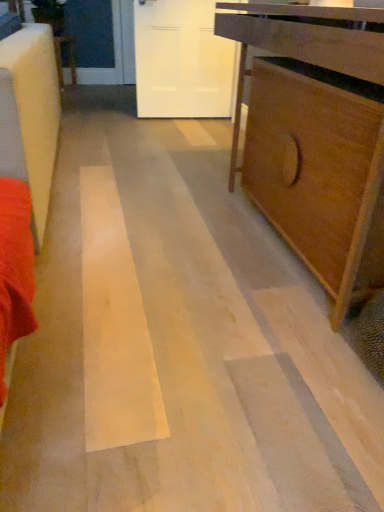
Question: Considering the relative sizes of matte brown cabinet at right and wooden table at center in the image provided, is matte brown cabinet at right wider than wooden table at center?

Choices:
 (A) no
 (B) yes

Answer: (B)

Question: Could you tell me if matte brown cabinet at right is turned towards wooden table at center?

Choices:
 (A) no
 (B) yes

Answer: (A)

Question: From the image's perspective, is matte brown cabinet at right under wooden table at center?

Choices:
 (A) yes
 (B) no

Answer: (A)

Question: Is matte brown cabinet at right turned away from wooden table at center?

Choices:
 (A) no
 (B) yes

Answer: (A)

Question: Does matte brown cabinet at right have a greater height compared to wooden table at center?

Choices:
 (A) no
 (B) yes

Answer: (B)

Question: Visually, is matte brown cabinet at right positioned to the left or to the right of white matte door at upper center?

Choices:
 (A) left
 (B) right

Answer: (B)

Question: From the image's perspective, is matte brown cabinet at right located above or below white matte door at upper center?

Choices:
 (A) below
 (B) above

Answer: (A)

Question: From a real-world perspective, is matte brown cabinet at right above or below white matte door at upper center?

Choices:
 (A) below
 (B) above

Answer: (A)

Question: Is matte brown cabinet at right situated inside white matte door at upper center or outside?

Choices:
 (A) inside
 (B) outside

Answer: (B)

Question: Is point (152, 106) positioned closer to the camera than point (352, 11)?

Choices:
 (A) closer
 (B) farther

Answer: (B)

Question: From a real-world perspective, is white matte door at upper center above or below matte brown cabinet at right?

Choices:
 (A) below
 (B) above

Answer: (B)

Question: Based on their positions, is white matte door at upper center located to the left or right of matte brown cabinet at right?

Choices:
 (A) right
 (B) left

Answer: (B)

Question: Which is correct: white matte door at upper center is inside matte brown cabinet at right, or outside of it?

Choices:
 (A) inside
 (B) outside

Answer: (B)

Question: In terms of size, does wooden table at center appear bigger or smaller than white matte door at upper center?

Choices:
 (A) small
 (B) big

Answer: (A)

Question: Is point (59, 82) closer or farther from the camera than point (195, 74)?

Choices:
 (A) farther
 (B) closer

Answer: (A)